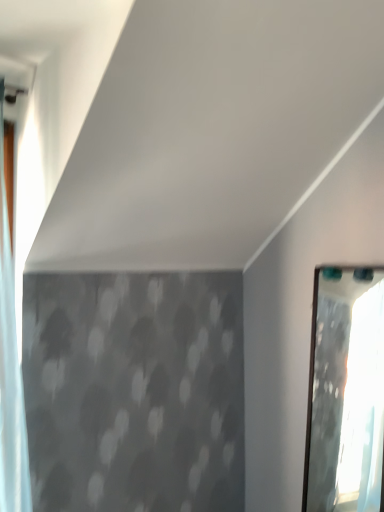
Find the location of a particular element. transparent glass window at upper right is located at coordinates (346, 393).

Describe the element at coordinates (346, 393) in the screenshot. I see `transparent glass window at upper right` at that location.

You are a GUI agent. You are given a task and a screenshot of the screen. Output one action in this format:
    pyautogui.click(x=<x>, y=<y>)
    Task: Click on the transparent glass window at upper right
    Image resolution: width=384 pixels, height=512 pixels.
    Given the screenshot: What is the action you would take?
    pyautogui.click(x=346, y=393)